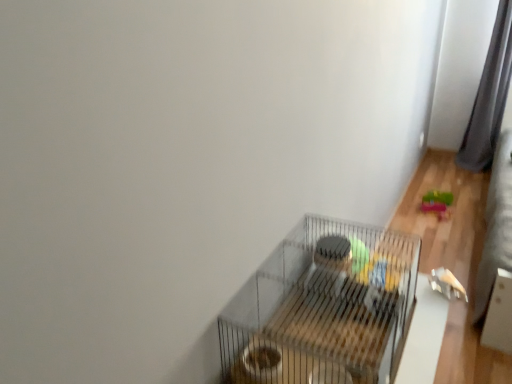
Question: From a real-world perspective, is metallic wire birdcage at center physically above gray fabric curtain at right?

Choices:
 (A) yes
 (B) no

Answer: (B)

Question: From the image's perspective, does metallic wire birdcage at center appear higher than gray fabric curtain at right?

Choices:
 (A) no
 (B) yes

Answer: (A)

Question: Can you confirm if metallic wire birdcage at center is bigger than gray fabric curtain at right?

Choices:
 (A) yes
 (B) no

Answer: (B)

Question: Is metallic wire birdcage at center wider than gray fabric curtain at right?

Choices:
 (A) yes
 (B) no

Answer: (B)

Question: Is metallic wire birdcage at center further to camera compared to gray fabric curtain at right?

Choices:
 (A) yes
 (B) no

Answer: (B)

Question: Is gray fabric curtain at right in front of or behind metallic wire birdcage at center in the image?

Choices:
 (A) behind
 (B) front

Answer: (A)

Question: Which is correct: gray fabric curtain at right is inside metallic wire birdcage at center, or outside of it?

Choices:
 (A) inside
 (B) outside

Answer: (B)

Question: In terms of width, does gray fabric curtain at right look wider or thinner when compared to metallic wire birdcage at center?

Choices:
 (A) wide
 (B) thin

Answer: (A)

Question: From the image's perspective, is gray fabric curtain at right above or below metallic wire birdcage at center?

Choices:
 (A) below
 (B) above

Answer: (B)

Question: Considering the positions of rubberized green toy at lower right and gray fabric curtain at right in the image, is rubberized green toy at lower right bigger or smaller than gray fabric curtain at right?

Choices:
 (A) small
 (B) big

Answer: (A)

Question: Looking at their shapes, would you say rubberized green toy at lower right is wider or thinner than gray fabric curtain at right?

Choices:
 (A) thin
 (B) wide

Answer: (A)

Question: In the image, is rubberized green toy at lower right positioned in front of or behind gray fabric curtain at right?

Choices:
 (A) behind
 (B) front

Answer: (B)

Question: From the image's perspective, is rubberized green toy at lower right above or below gray fabric curtain at right?

Choices:
 (A) below
 (B) above

Answer: (A)

Question: From a real-world perspective, is metallic wire birdcage at center physically located above or below gray fabric curtain at right?

Choices:
 (A) above
 (B) below

Answer: (B)

Question: Is metallic wire birdcage at center in front of or behind gray fabric curtain at right in the image?

Choices:
 (A) front
 (B) behind

Answer: (A)